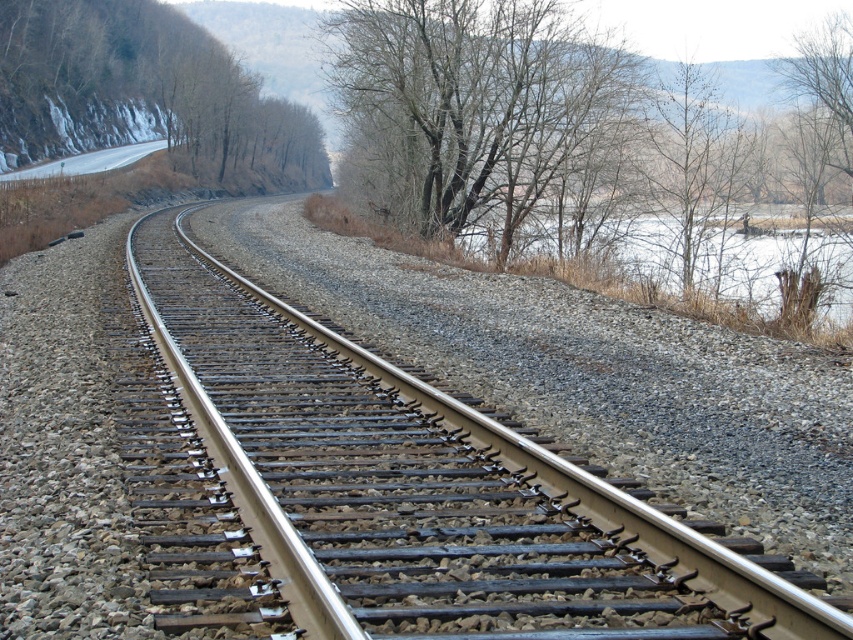
You are standing at point (428, 488) in the image. What object is directly beneath your feet?

The metal smooth track at center is directly beneath your feet at point (428, 488).